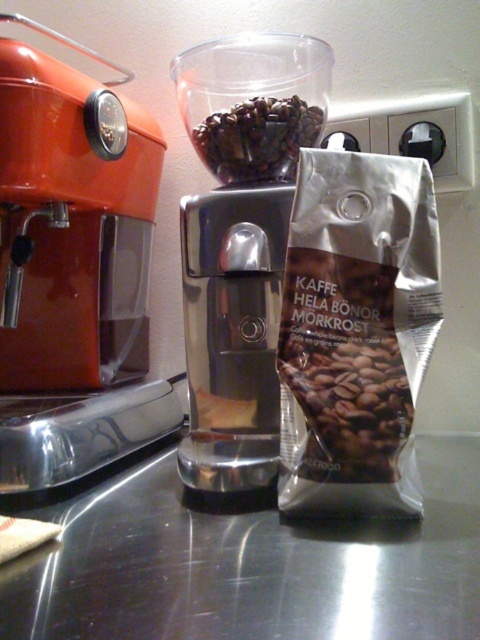
You are a barista setting up your workstation. You need to place a new spice jar between the orange glossy coffee machine at left and the transparent plastic blender at center. Based on their positions, which object should the spice jar be closer to?

The orange glossy coffee machine at left is closer to the viewer than the transparent plastic blender at center, so the spice jar should be placed closer to the transparent plastic blender at center to maintain the spatial relationship.

You are a barista trying to arrange items on the kitchen countertop. You have a metallic reflective surface at center and dark matte coffee beans at center. Where should you place the beans relative to the reflective surface to maintain the current setup?

The dark matte coffee beans at center should be placed to the left of the metallic reflective surface at center to maintain the current setup, as the metallic reflective surface at center is currently to the right of the dark matte coffee beans at center.